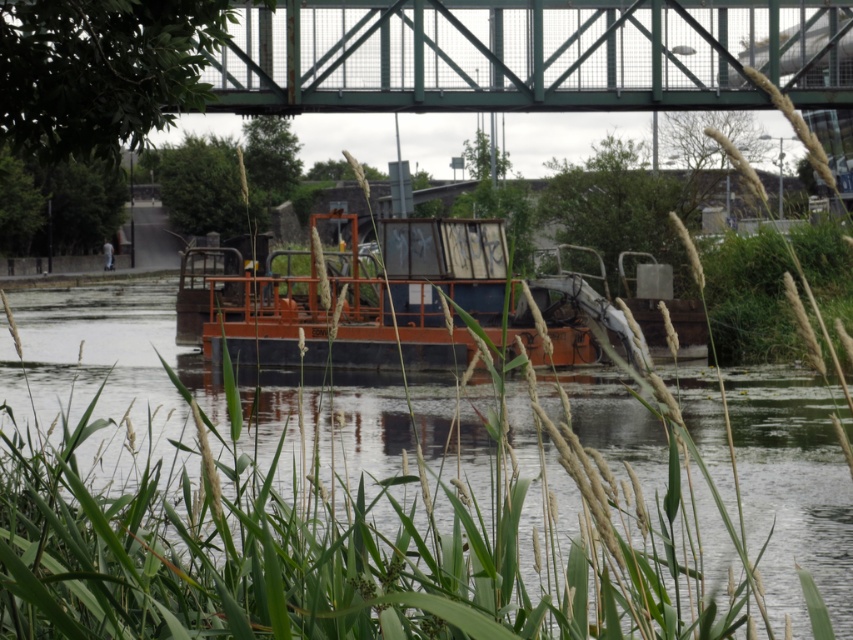
You are standing on the green metal bridge and want to place a 15 foot long wooden plank between the rusty metal barge at center and the reeds. Can you do it?

The distance between the rusty metal barge at center and the reeds is 15.43 feet. Since the wooden plank is 15 feet long, it is slightly shorter than the gap. Therefore, the plank would not reach across the entire distance, making it unsuitable for safe placement.

You are a delivery drone that needs to fly from the rusty metal barge at center to the green metal bridge at upper center. Can you fly directly between them without any obstacles?

The rusty metal barge at center is not as tall as the green metal bridge at upper center, so yes, the drone can fly directly between them since the bridge is taller and there is no mention of other obstacles in the scene.